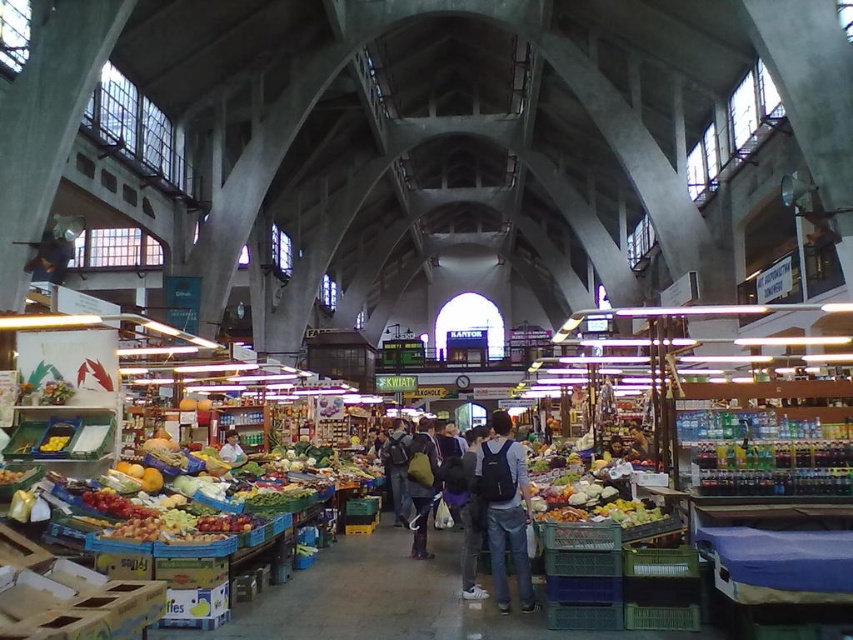
Question: Can you confirm if dark blue backpack at center is wider than denim jacket at center?

Choices:
 (A) yes
 (B) no

Answer: (A)

Question: Among these objects, which one is farthest from the camera?

Choices:
 (A) dark gray backpack at center
 (B) denim jacket at center
 (C) light brown leather jacket at center

Answer: (C)

Question: Is dark blue backpack at center in front of denim jacket at center?

Choices:
 (A) no
 (B) yes

Answer: (B)

Question: Which point is farther to the camera?

Choices:
 (A) (526, 554)
 (B) (231, 461)

Answer: (B)

Question: Among these points, which one is nearest to the camera?

Choices:
 (A) (480, 472)
 (B) (410, 486)
 (C) (397, 468)

Answer: (A)

Question: Does dark blue backpack at center appear under denim jacket at center?

Choices:
 (A) no
 (B) yes

Answer: (B)